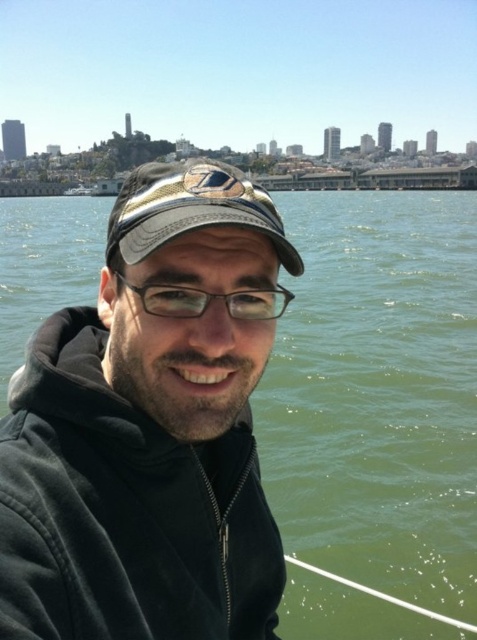
You are a photographer trying to capture the metallic gold cap at center and transparent plastic glasses at center in a single frame. Based on their positions, which object should you focus on first to ensure both are in the same shot?

The metallic gold cap at center is above transparent plastic glasses at center, so you should focus on the transparent plastic glasses at center first to ensure both are in the frame.

You are a photographer trying to capture the reflection of the cityscape in the green water at center. However, the transparent plastic glasses at center are blocking your view. How can you adjust your position to see the reflection without moving the glasses?

The green water at center is much taller than the transparent plastic glasses at center, so you can lower your camera angle to look under the glasses and still see the reflection in the green water at center.